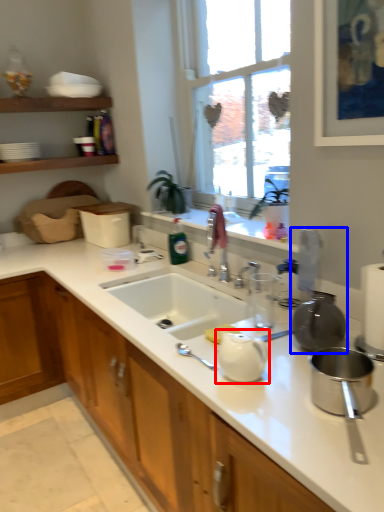
Question: Which object is further to the camera taking this photo, tea pot (highlighted by a red box) or appliance (highlighted by a blue box)?

Choices:
 (A) tea pot
 (B) appliance

Answer: (B)